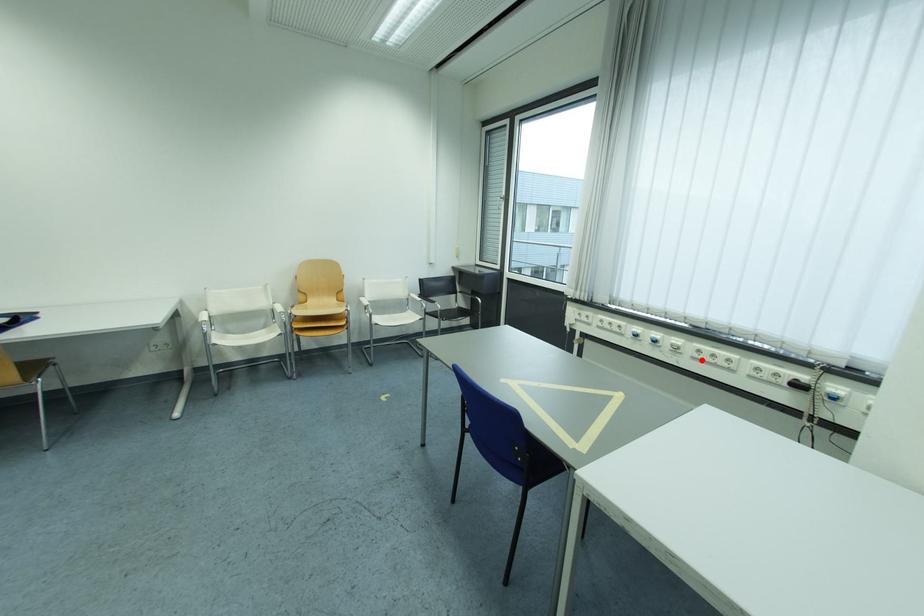
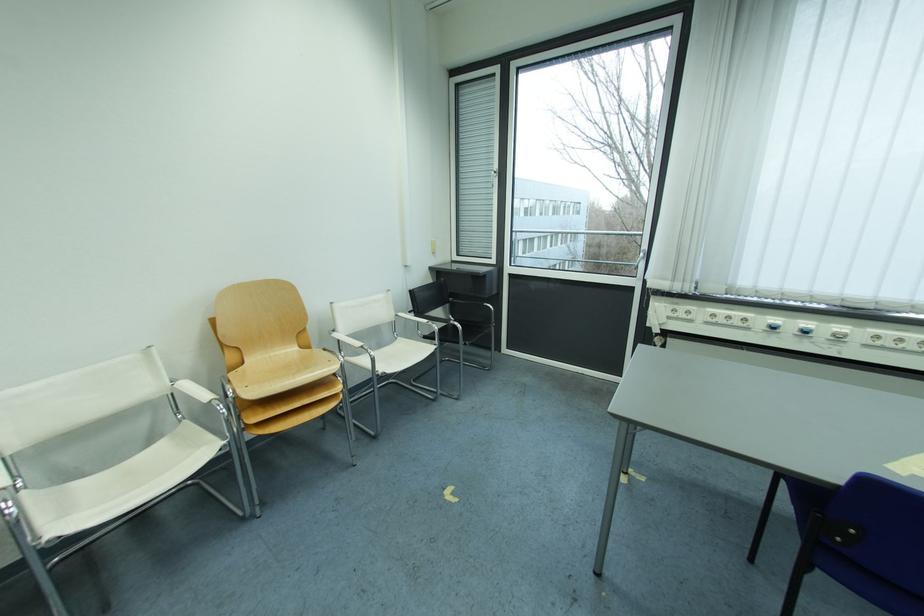
In the second image, find the point that corresponds to the highlighted location in the first image.

(874, 347)